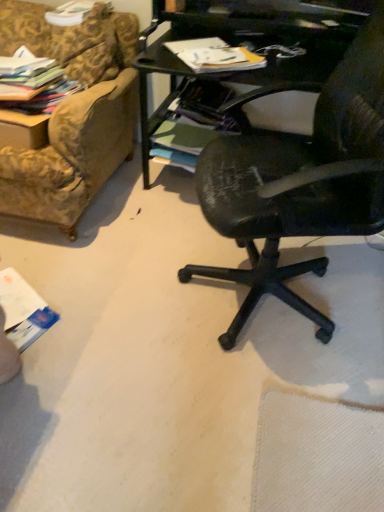
Question: In the image, is gold-patterned fabric couch at upper left on the left side or the right side of matte paper magazine at upper center, the first magazine when ordered from right to left?

Choices:
 (A) right
 (B) left

Answer: (B)

Question: From a real-world perspective, is gold-patterned fabric couch at upper left positioned above or below matte paper magazine at upper center, which ranks as the 2th magazine in left-to-right order?

Choices:
 (A) below
 (B) above

Answer: (A)

Question: Which of these objects is positioned farthest from the gold-patterned fabric couch at upper left?

Choices:
 (A) multicolored fabric stack at upper left, the 2th magazine when ordered from right to left
 (B) matte paper magazine at upper center, the first magazine when ordered from right to left

Answer: (B)

Question: Which is nearer to the gold-patterned fabric couch at upper left?

Choices:
 (A) multicolored fabric stack at upper left, the 2th magazine when ordered from right to left
 (B) matte paper magazine at upper center, which ranks as the 2th magazine in left-to-right order

Answer: (A)